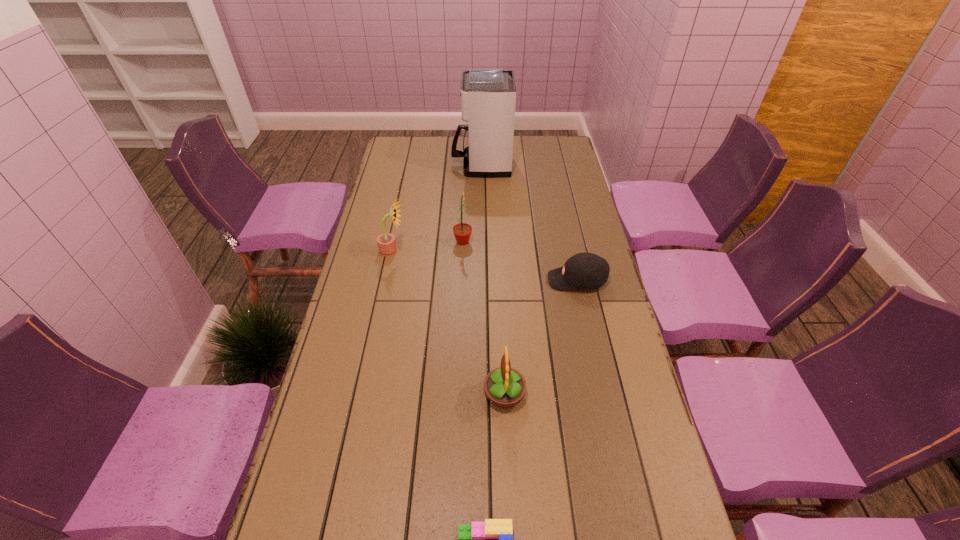
Where is `object that stands as the closest to the second shortest object`? object that stands as the closest to the second shortest object is located at coordinates (462, 231).

Find the location of `sunflower that can be found as the closest to the nearest object`. sunflower that can be found as the closest to the nearest object is located at coordinates (505, 387).

Identify the location of sunflower identified as the closest to the rightmost sunflower. The height and width of the screenshot is (540, 960). (462, 231).